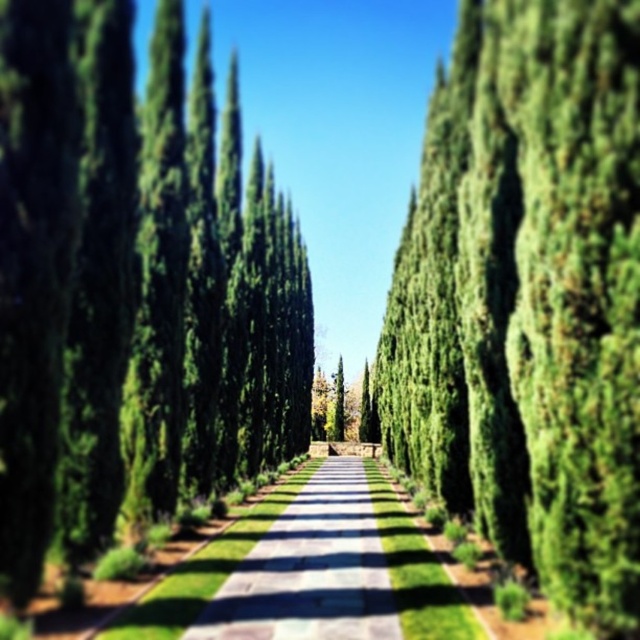
Question: Which of the following is the farthest from the observer?

Choices:
 (A) green glossy trees at center
 (B) green leafy tree at center
 (C) green concrete path at center

Answer: (C)

Question: Which point appears closest to the camera in this image?

Choices:
 (A) tap(188, 182)
 (B) tap(572, 586)

Answer: (B)

Question: Is green leafy tree at center thinner than green concrete path at center?

Choices:
 (A) yes
 (B) no

Answer: (A)

Question: In this image, where is green leafy tree at center located relative to green concrete path at center?

Choices:
 (A) below
 (B) above

Answer: (B)

Question: Is green glossy trees at center positioned at the back of green concrete path at center?

Choices:
 (A) yes
 (B) no

Answer: (B)

Question: Estimate the real-world distances between objects in this image. Which object is farther from the green concrete path at center?

Choices:
 (A) green glossy trees at center
 (B) green leafy tree at center

Answer: (B)